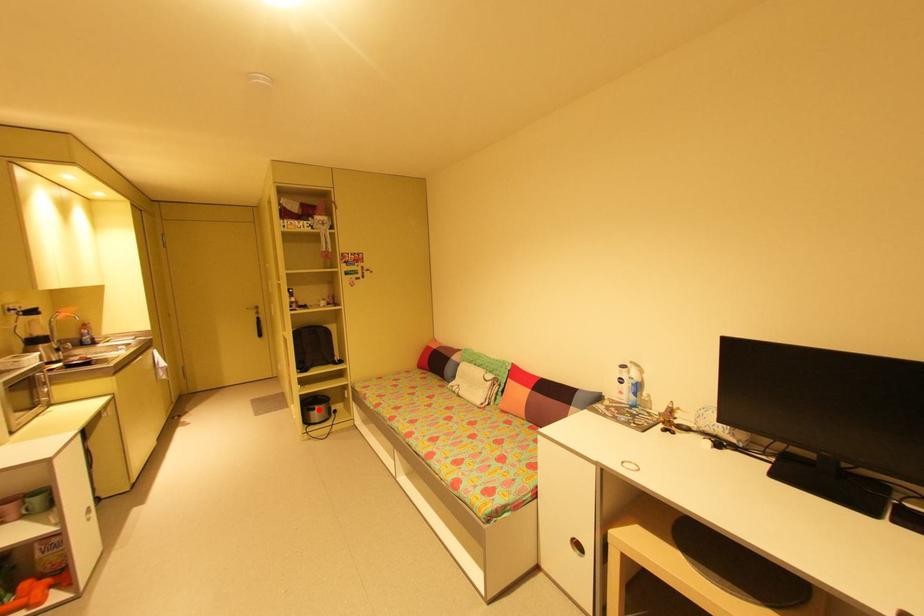
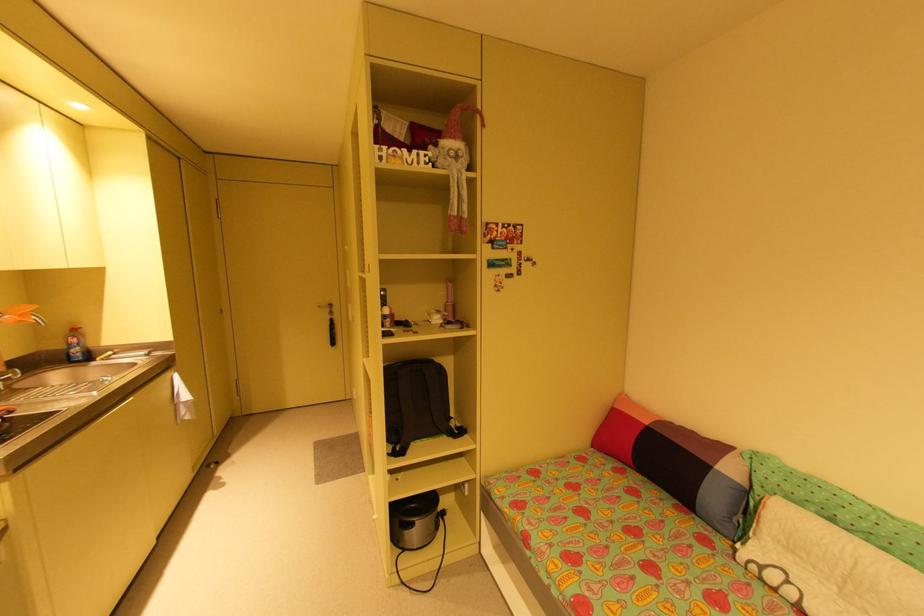
Where in the second image is the point corresponding to the highlighted location from the first image?

(417, 525)